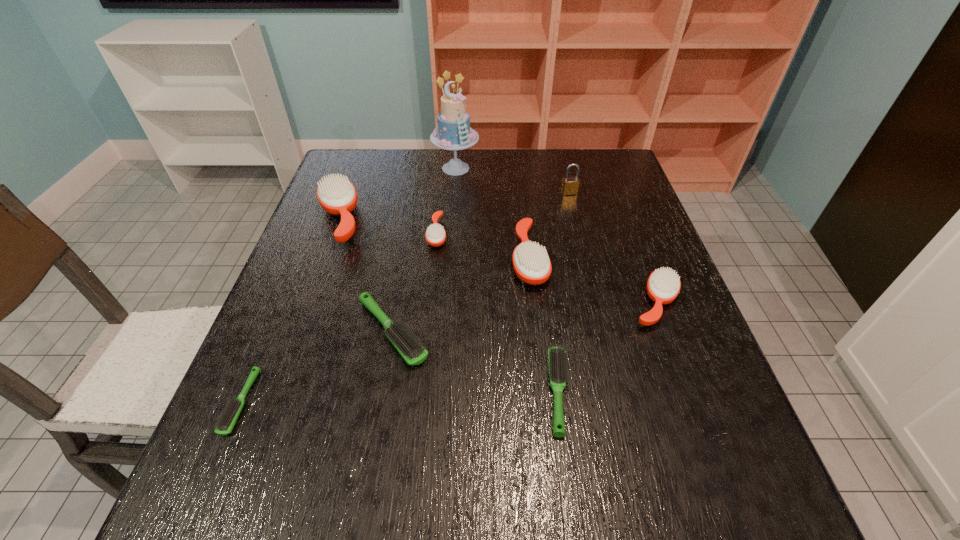
This screenshot has width=960, height=540. Identify the location of cake. (453, 132).

Identify the location of blue cake. Image resolution: width=960 pixels, height=540 pixels. (453, 132).

Image resolution: width=960 pixels, height=540 pixels. I want to click on the eighth object from left to right, so (x=570, y=185).

This screenshot has height=540, width=960. Find the location of `the second tallest object`. the second tallest object is located at coordinates (570, 185).

Find the location of `the leftmost orange hairbrush`. the leftmost orange hairbrush is located at coordinates (337, 196).

You are a GUI agent. You are given a task and a screenshot of the screen. Output one action in this format:
    pyautogui.click(x=<x>, y=<y>)
    Task: Click on the tallest hairbrush
    This screenshot has height=540, width=960.
    Given the screenshot: What is the action you would take?
    pyautogui.click(x=337, y=196)

The height and width of the screenshot is (540, 960). Find the location of `the third smallest orange hairbrush`. the third smallest orange hairbrush is located at coordinates (531, 263).

In order to click on the sixth shortest object in this screenshot , I will do `click(531, 263)`.

This screenshot has width=960, height=540. I want to click on the fifth shortest hairbrush, so click(x=663, y=286).

Identify the location of the third biggest orange hairbrush. This screenshot has width=960, height=540. (663, 286).